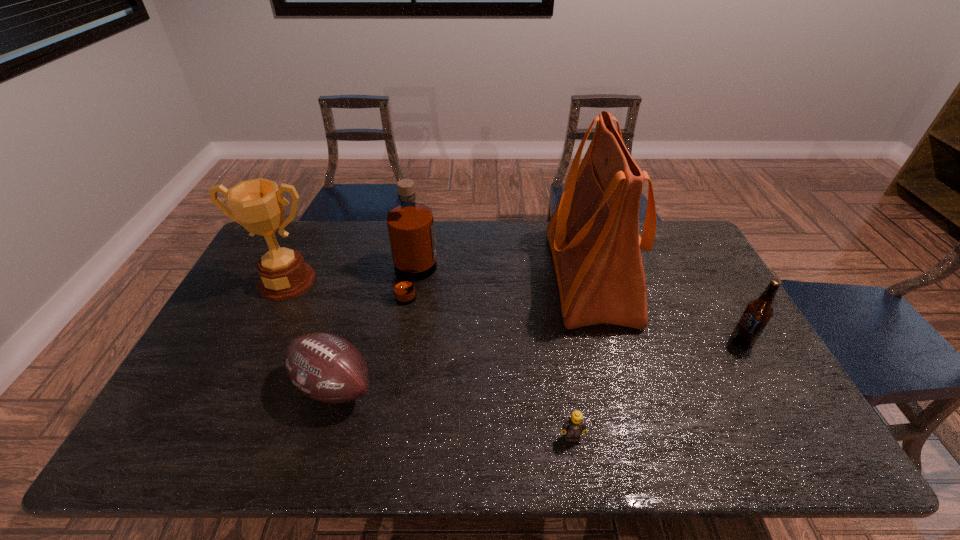
Locate an element on the screen. This screenshot has width=960, height=540. object located in the near edge section of the desktop is located at coordinates (574, 426).

Locate an element on the screen. This screenshot has width=960, height=540. object present at the left edge is located at coordinates (258, 205).

At what (x,y) coordinates should I click in order to perform the action: click on object that is at the right edge. Please return your answer as a coordinate pair (x, y). Looking at the image, I should click on (758, 312).

Identify the location of vacant space at the far edge of the desktop. The image size is (960, 540). (329, 222).

You are a GUI agent. You are given a task and a screenshot of the screen. Output one action in this format:
    pyautogui.click(x=<x>, y=<y>)
    Task: Click on the free location at the near edge of the desktop
    This screenshot has width=960, height=540.
    Given the screenshot: What is the action you would take?
    pyautogui.click(x=262, y=454)

Locate an element on the screen. vacant position at the right edge of the desktop is located at coordinates (684, 294).

Identify the location of free space at the far right corner of the desktop. The width and height of the screenshot is (960, 540). (672, 222).

Where is `vacant space that's between the shopping bag and the nearest object`? This screenshot has height=540, width=960. vacant space that's between the shopping bag and the nearest object is located at coordinates (581, 356).

I want to click on free space between the award and the shopping bag, so click(439, 278).

This screenshot has height=540, width=960. Find the location of `vacant space in between the football (American) and the third nearest object`. vacant space in between the football (American) and the third nearest object is located at coordinates (537, 364).